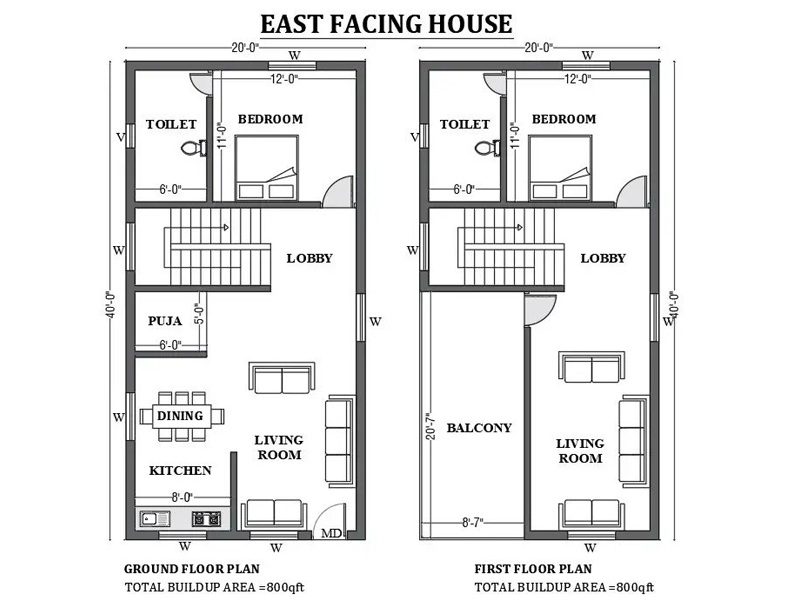
Locate an element on the screen. toilets is located at coordinates (190, 145), (490, 144).